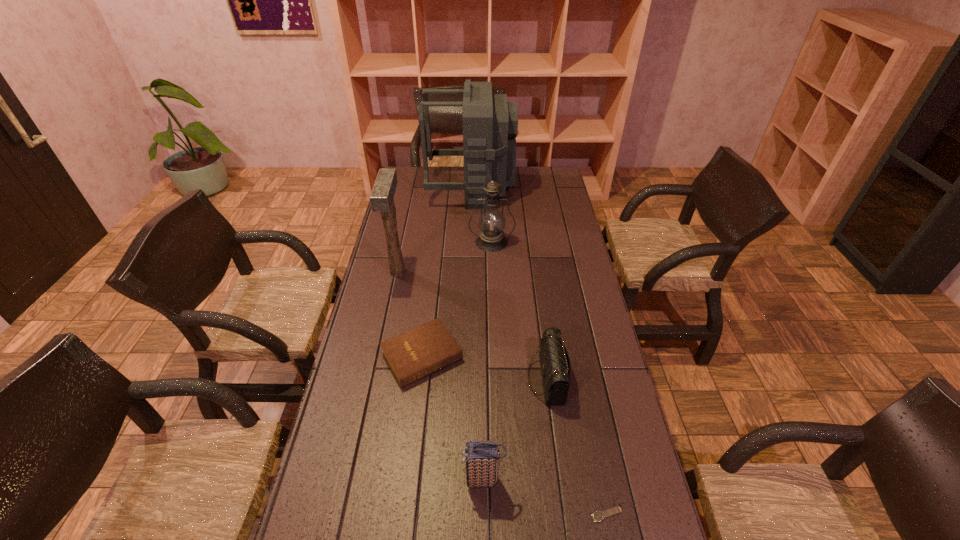
This screenshot has height=540, width=960. In order to click on the farthest object in this screenshot , I will do `click(490, 124)`.

The width and height of the screenshot is (960, 540). I want to click on the tallest object, so click(x=490, y=124).

Where is `the second tallest object`? This screenshot has width=960, height=540. the second tallest object is located at coordinates (381, 198).

This screenshot has height=540, width=960. What are the coordinates of `mallet` in the screenshot? It's located at (381, 198).

The image size is (960, 540). What are the coordinates of `the second farthest object` in the screenshot? It's located at (492, 222).

Locate an element on the screen. The height and width of the screenshot is (540, 960). oil lamp is located at coordinates (492, 222).

Where is `the second nearest object`? The width and height of the screenshot is (960, 540). the second nearest object is located at coordinates (482, 458).

This screenshot has width=960, height=540. What are the coordinates of `the left clutch bag` in the screenshot? It's located at (482, 458).

Image resolution: width=960 pixels, height=540 pixels. I want to click on the fifth tallest object, so click(554, 360).

Find the location of a particular element. The image size is (960, 540). the farther clutch bag is located at coordinates (554, 360).